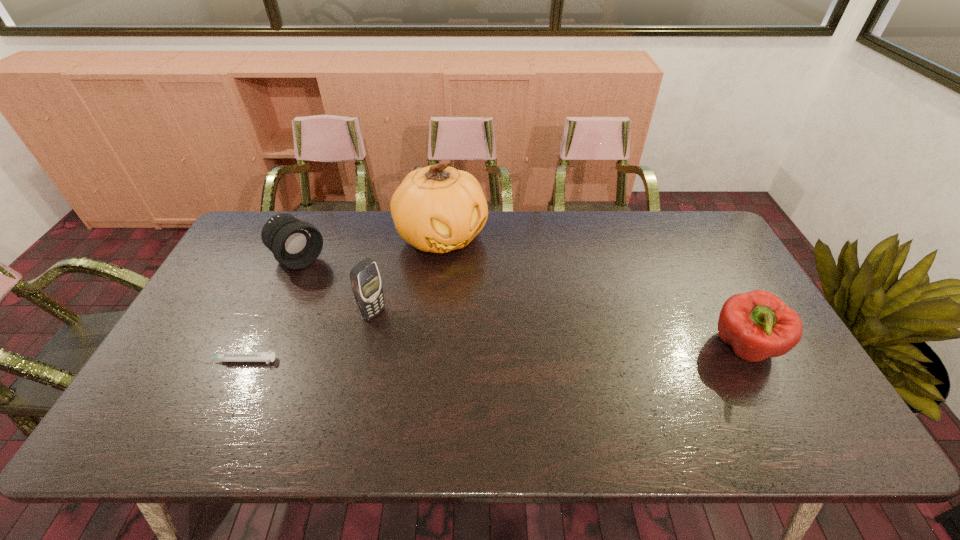
The image size is (960, 540). I want to click on telephoto lens that is at the left edge, so click(x=296, y=244).

Where is `object that is positioned at the right edge`? object that is positioned at the right edge is located at coordinates (758, 325).

This screenshot has height=540, width=960. In order to click on object that is at the far left corner in this screenshot , I will do `click(296, 244)`.

Find the location of a particular element. This screenshot has width=960, height=540. object located at the near right corner is located at coordinates (758, 325).

Locate an element on the screen. free spot at the far edge of the desktop is located at coordinates (525, 216).

What are the coordinates of `free space at the near edge of the desktop` in the screenshot? It's located at (587, 389).

I want to click on vacant region at the left edge of the desktop, so click(188, 363).

The height and width of the screenshot is (540, 960). I want to click on vacant region at the far left corner, so click(x=260, y=212).

Locate an element on the screen. The width and height of the screenshot is (960, 540). vacant position at the near left corner of the desktop is located at coordinates (169, 389).

What are the coordinates of `free space at the far right corner` in the screenshot? It's located at pos(673,238).